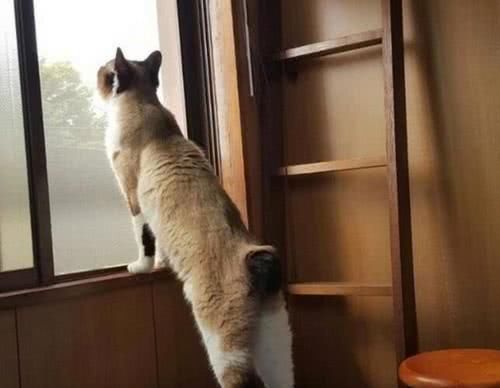
Locate an element on the screen. This screenshot has width=500, height=388. wooden ladder is located at coordinates (396, 194).